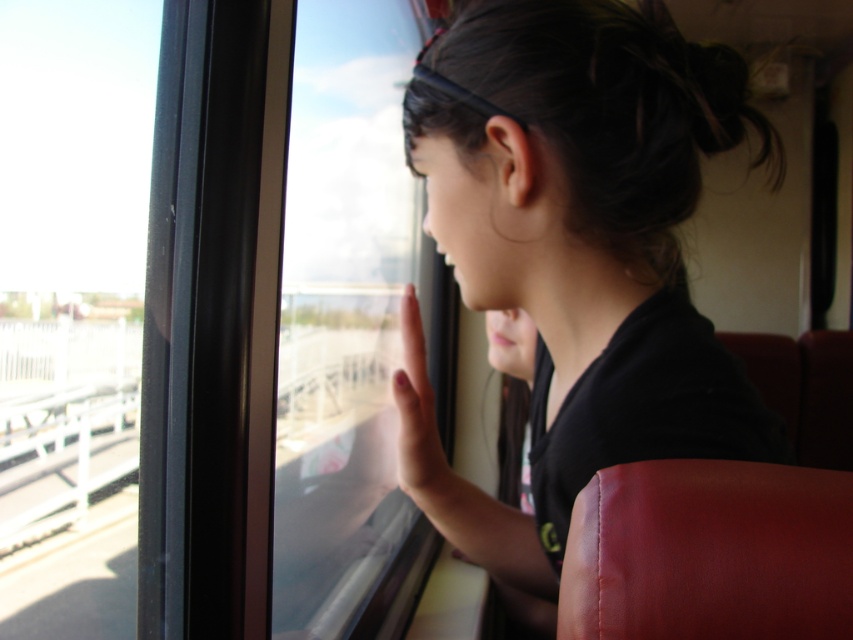
You are a passenger on the train and want to see the view outside. You notice the black matte hair at upper center and the transparent glass window at center. Which object is closer to your eye level?

The transparent glass window at center is taller than the black matte hair at upper center, so the black matte hair at upper center is closer to your eye level.

You are a passenger on a train and want to get a better view of the waterfront outside. You have two windows available to look through, the transparent glass train window at left and the transparent glass window at center. Which window should you choose to have a wider field of view?

The transparent glass train window at left is bigger than the transparent glass window at center, so choosing the transparent glass train window at left will provide a wider field of view.